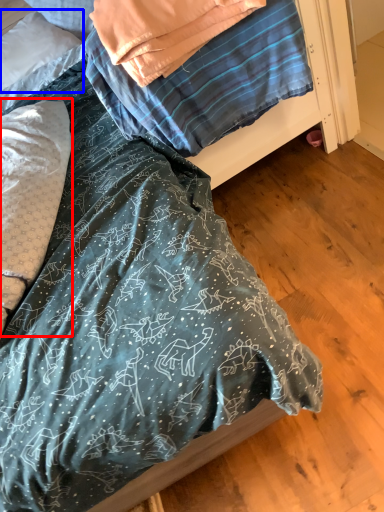
Question: Which object appears farthest to the camera in this image, pillow (highlighted by a red box) or pillow (highlighted by a blue box)?

Choices:
 (A) pillow
 (B) pillow

Answer: (B)